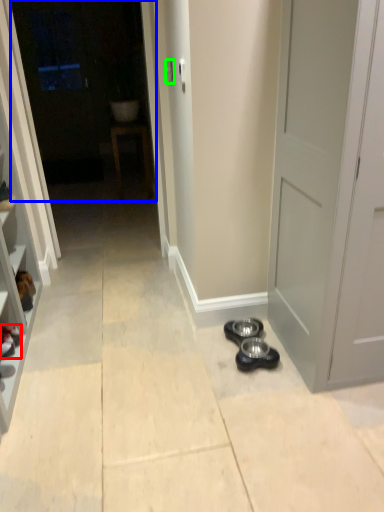
Question: Considering the real-world distances, which object is farthest from footwear (highlighted by a red box)? glass door (highlighted by a blue box) or door handle (highlighted by a green box)?

Choices:
 (A) glass door
 (B) door handle

Answer: (A)